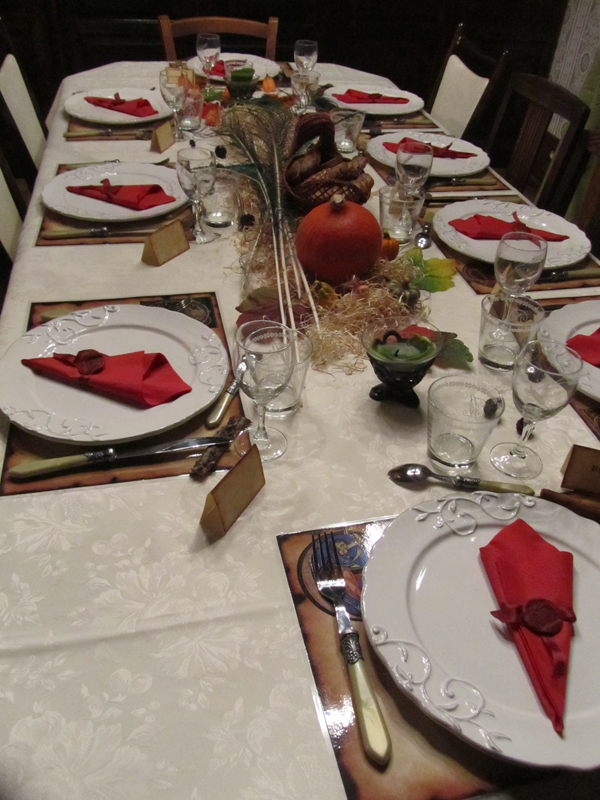
Identify the location of napkins. (525, 566), (588, 346), (147, 378), (152, 196), (485, 226), (391, 142), (355, 96), (137, 106), (219, 69).